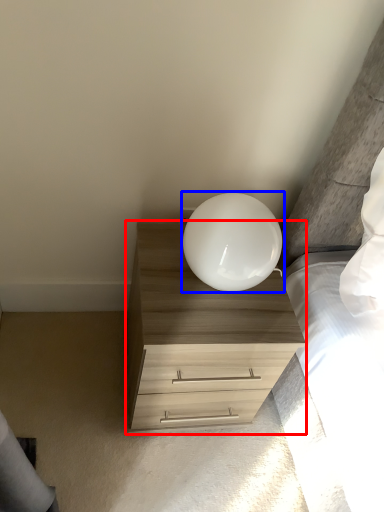
Question: Which object is closer to the camera taking this photo, chest of drawers (highlighted by a red box) or lamp (highlighted by a blue box)?

Choices:
 (A) chest of drawers
 (B) lamp

Answer: (B)